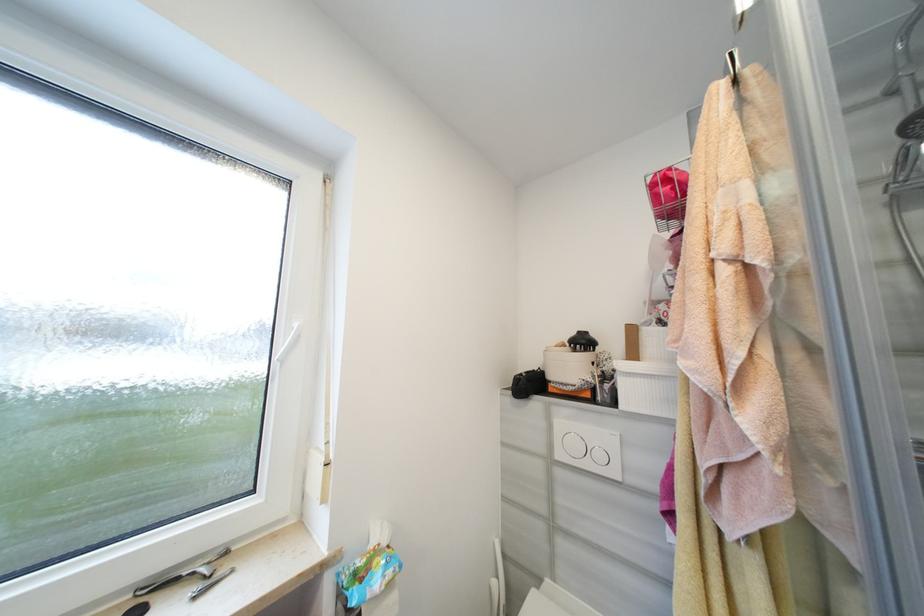
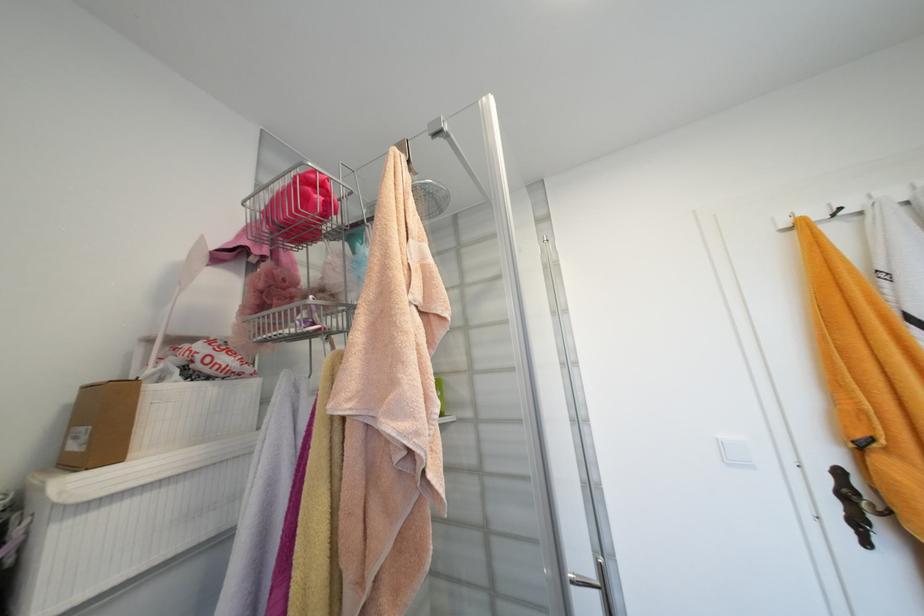
Question: The camera is either moving clockwise (left) or counter-clockwise (right) around the object. The first image is from the beginning of the video and the second image is from the end. Is the camera moving left or right when shooting the video?

Choices:
 (A) Left
 (B) Right

Answer: (A)